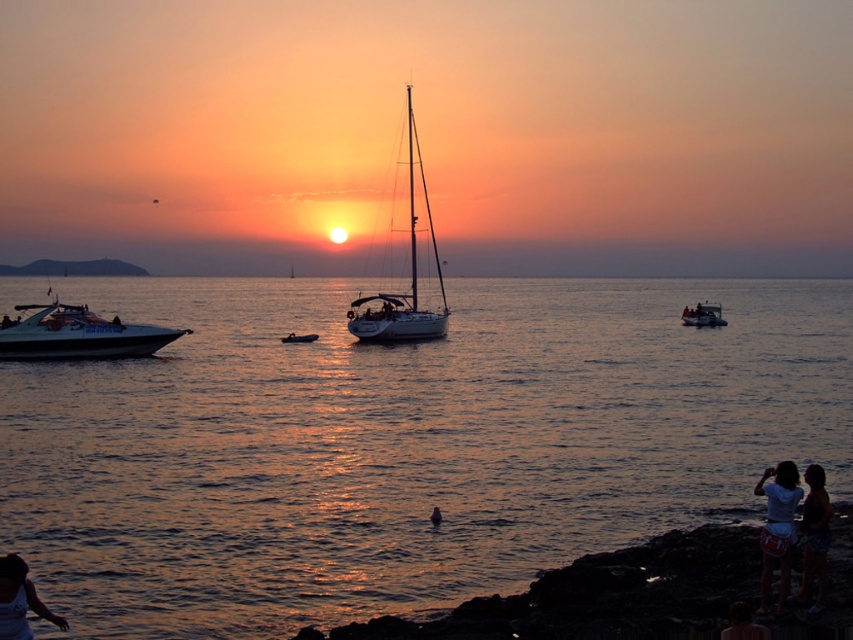
You are standing on the rocky shoreline where the two individuals are observing the sunset. You want to reach the smooth ocean surface at center to place a floating lantern. According to the coordinates provided, is the point at [643,259] on the smooth ocean surface at center?

Yes, the point at [643,259] is on the smooth ocean surface at center according to the coordinates provided.